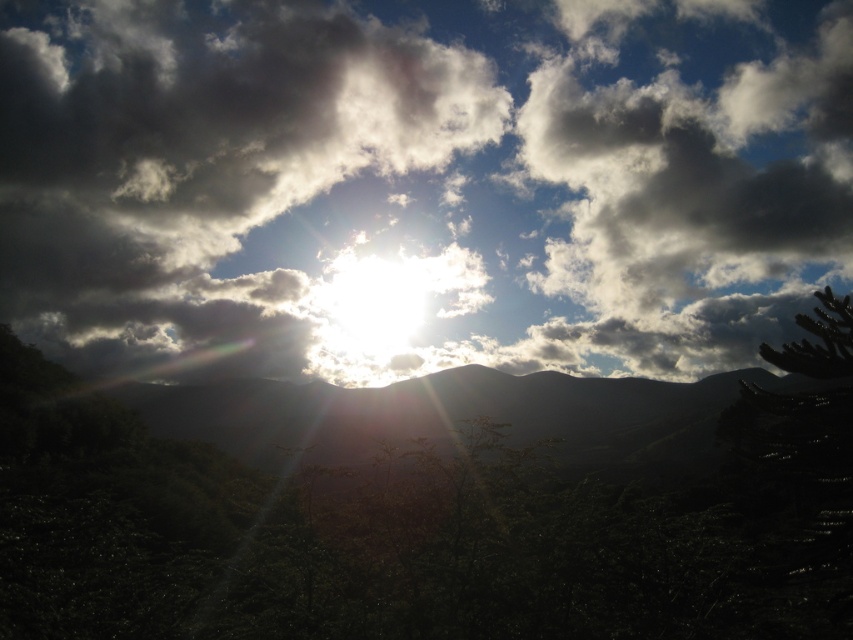
You are an astronomer observing the sky and want to determine the position of the white fluffy cloud at upper center relative to the green leafy tree at center. Which object is located to the right of the other?

The white fluffy cloud at upper center is positioned on the right side of green leafy tree at center.

You are an artist trying to paint this scene. You want to ensure the white fluffy cloud at upper center and the green leafy tree at center are proportionally accurate. Which object should you draw taller?

The white fluffy cloud at upper center is taller than the green leafy tree at center, so you should draw the white fluffy cloud at upper center taller than the green leafy tree at center.